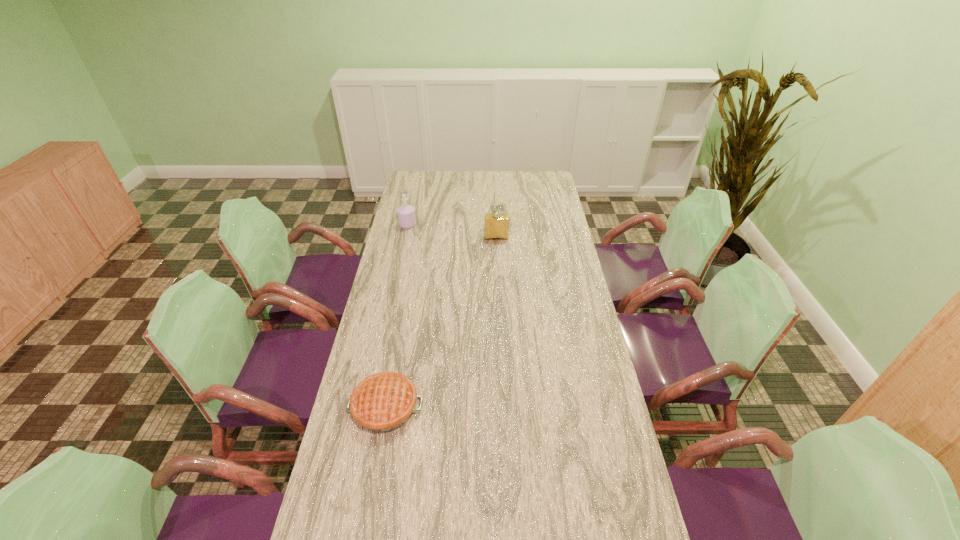
I want to click on the left perfume, so click(x=406, y=214).

The image size is (960, 540). Find the location of `the farthest object`. the farthest object is located at coordinates (406, 214).

Image resolution: width=960 pixels, height=540 pixels. What are the coordinates of `the nearer perfume` in the screenshot? It's located at (496, 225).

You are a GUI agent. You are given a task and a screenshot of the screen. Output one action in this format:
    pyautogui.click(x=<x>, y=<y>)
    Task: Click on the right perfume
    The image size is (960, 540).
    Given the screenshot: What is the action you would take?
    pyautogui.click(x=496, y=225)

Image resolution: width=960 pixels, height=540 pixels. What are the coordinates of `the nearest object` in the screenshot? It's located at pos(382,402).

Where is `the shortest object`? the shortest object is located at coordinates (382, 402).

The image size is (960, 540). What are the coordinates of `vacant space situated on the front of the farther perfume` in the screenshot? It's located at (399, 261).

Image resolution: width=960 pixels, height=540 pixels. In order to click on vacant space located on the front-facing side of the nearer perfume in this screenshot , I will do `click(498, 279)`.

Locate an element on the screen. This screenshot has height=540, width=960. free region located 0.390m on the back of the shortest object is located at coordinates (406, 295).

Identify the location of perfume that is at the left edge. This screenshot has width=960, height=540. (406, 214).